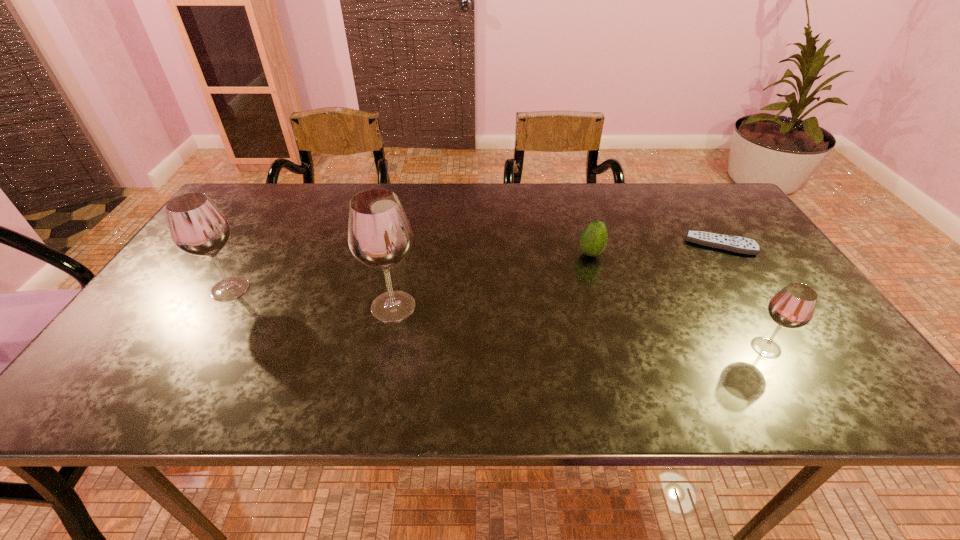
The width and height of the screenshot is (960, 540). Find the location of `free space located 0.330m on the back of the third tallest object`. free space located 0.330m on the back of the third tallest object is located at coordinates (703, 245).

At what (x,y) coordinates should I click in order to perform the action: click on vacant space located on the right of the avocado. Please return your answer as a coordinate pair (x, y). This screenshot has height=540, width=960. Looking at the image, I should click on (640, 254).

What are the coordinates of `vacant space positioned on the back of the remote control` in the screenshot? It's located at (682, 187).

Locate an element on the screen. The width and height of the screenshot is (960, 540). object that is at the near edge is located at coordinates (793, 306).

Find the location of a particular element. object that is at the left edge is located at coordinates (197, 227).

Where is `wineglass situated at the right edge`? wineglass situated at the right edge is located at coordinates (793, 306).

Identify the location of remote control that is at the right edge. (736, 244).

I want to click on object at the near right corner, so click(x=793, y=306).

Where is `vacant region at the far edge of the desktop`? This screenshot has height=540, width=960. vacant region at the far edge of the desktop is located at coordinates (493, 193).

The image size is (960, 540). Find the location of `vacant space at the near edge`. vacant space at the near edge is located at coordinates (722, 362).